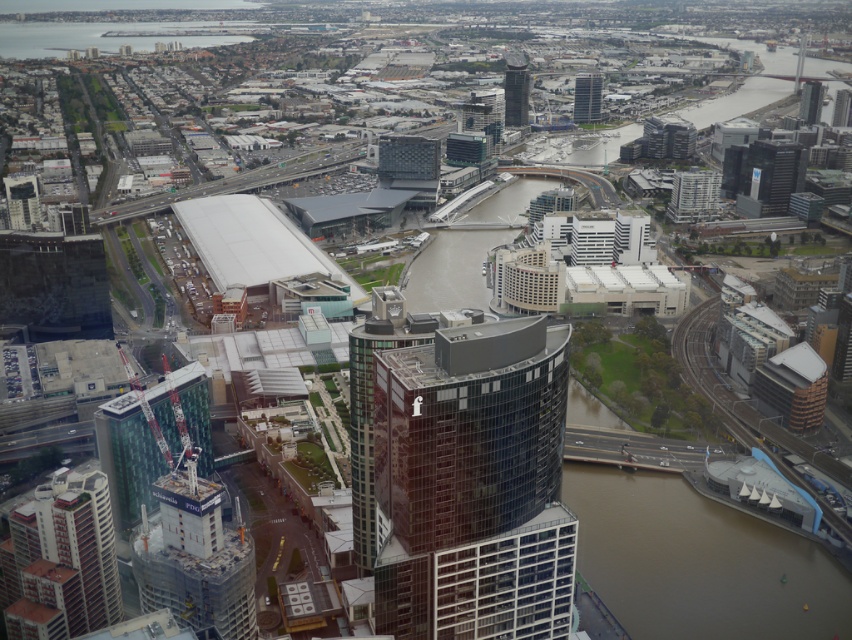
Based on the photo, you are a drone operator trying to navigate between two points in the city. The first point is point (154, 397) and the second is point (519, 88). From your aerial view, which point is closer to the observer?

Point (154, 397) is in front of point (519, 88), so it is closer to the observer.

You are a city planner assessing the impact of new construction projects. Given the current layout, would the concrete construction crane at lower left potentially block sunlight to the glassy reflective skyscraper at upper right?

The concrete construction crane at lower left is much taller than the glassy reflective skyscraper at upper right, so it could potentially block sunlight to the glassy reflective skyscraper at upper right.

In the scene shown: You are a drone operator trying to capture a photo of the city center. Your drone is currently positioned at point 0.8, 0.8. You want to fly directly towards the brown water at lower right. Will you pass over any buildings before reaching it?

The brown water at lower right is located at point (698,561). Since your drone is at (681,512), the straight path would move towards increasing x and y coordinates. The buildings around the brown water might block the path, but according to the scene description, the river is in the middle with banks lined with buildings. The direct line from your position to the water might pass over open areas near the riverbank, so it might be possible without hitting buildings. However, the curved building in the fore